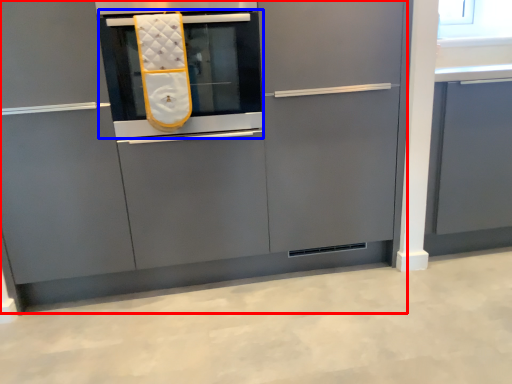
Question: Among these objects, which one is farthest to the camera, cabinetry (highlighted by a red box) or oven (highlighted by a blue box)?

Choices:
 (A) cabinetry
 (B) oven

Answer: (B)